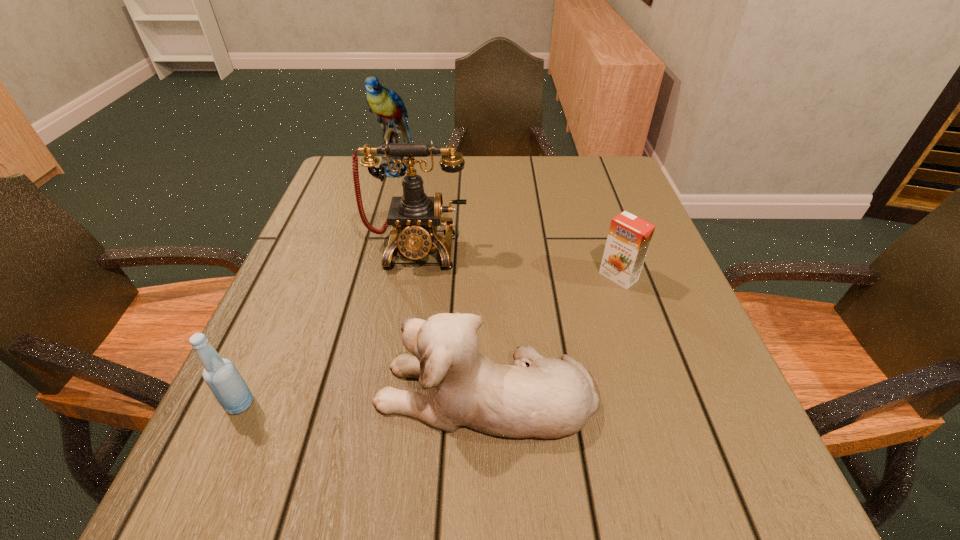
Where is `object that is the second closest to the farthest object`? object that is the second closest to the farthest object is located at coordinates tap(629, 237).

This screenshot has width=960, height=540. In order to click on object that is the fourth nearest to the puppy in this screenshot , I will do `click(387, 106)`.

Image resolution: width=960 pixels, height=540 pixels. Identify the location of free location that satisfies the following two spatial constraints: 1. on the front of the rightmost object, featuring the rotary dial; 2. on the left side of the telephone. (413, 276).

Where is `vacant area that satisfies the following two spatial constraints: 1. on the face of the shortest object; 2. on the right side of the parrot`? This screenshot has width=960, height=540. vacant area that satisfies the following two spatial constraints: 1. on the face of the shortest object; 2. on the right side of the parrot is located at coordinates (365, 276).